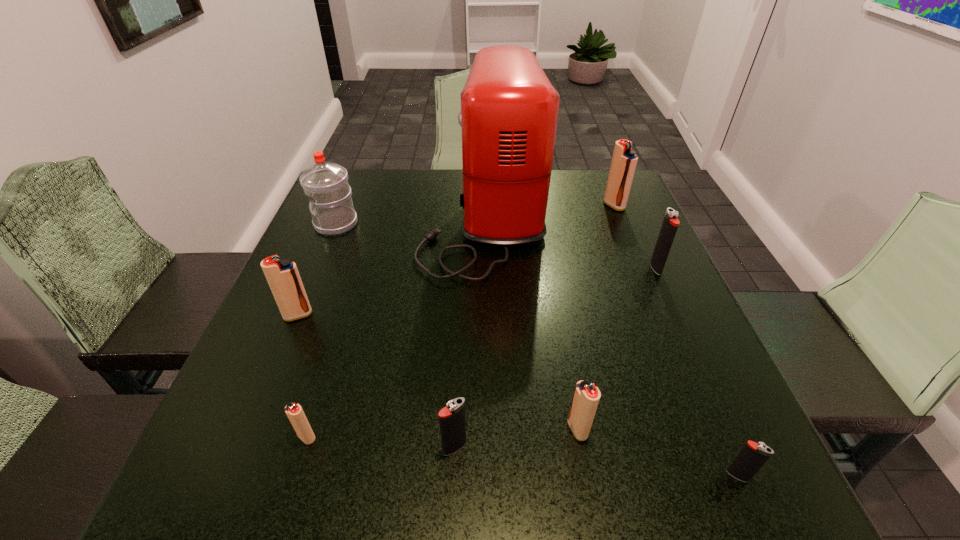
At what (x,y) coordinates should I click in order to perform the action: click on the closest object to the nearest black igniter. Please return your answer as a coordinate pair (x, y). Image resolution: width=960 pixels, height=540 pixels. Looking at the image, I should click on (586, 397).

Where is `object that can be found as the seventh closest to the second farthest black igniter`? This screenshot has height=540, width=960. object that can be found as the seventh closest to the second farthest black igniter is located at coordinates (326, 184).

Locate which igniter is the sixth closest to the fourth igniter from right to left. Please provide its 2D coordinates. Your answer should be formatted as a tuple, i.e. [(x, y)], where the tuple contains the x and y coordinates of a point satisfying the conditions above.

[(624, 161)]

Identify the location of igniter object that ranks as the sixth closest to the white water bottle. (670, 224).

Locate an element on the screen. the second closest red igniter to the second igniter from left to right is located at coordinates (586, 397).

Identify which red igniter is the fourth nearest to the nearest object. Please provide its 2D coordinates. Your answer should be formatted as a tuple, i.e. [(x, y)], where the tuple contains the x and y coordinates of a point satisfying the conditions above.

[(283, 277)]

Identify which black igniter is the second nearest to the second igniter from left to right. Please provide its 2D coordinates. Your answer should be formatted as a tuple, i.e. [(x, y)], where the tuple contains the x and y coordinates of a point satisfying the conditions above.

[(752, 457)]

This screenshot has height=540, width=960. In order to click on the closest black igniter to the biggest black igniter in this screenshot , I will do `click(752, 457)`.

Where is `free space in the image that satisfies the following two spatial constraints: 1. on the back side of the second biggest red igniter; 2. on the left side of the rightmost red igniter`? free space in the image that satisfies the following two spatial constraints: 1. on the back side of the second biggest red igniter; 2. on the left side of the rightmost red igniter is located at coordinates (344, 206).

The width and height of the screenshot is (960, 540). Find the location of `free point that satisfies the following two spatial constraints: 1. on the handle side of the water bottle; 2. on the right side of the farthest black igniter`. free point that satisfies the following two spatial constraints: 1. on the handle side of the water bottle; 2. on the right side of the farthest black igniter is located at coordinates (318, 268).